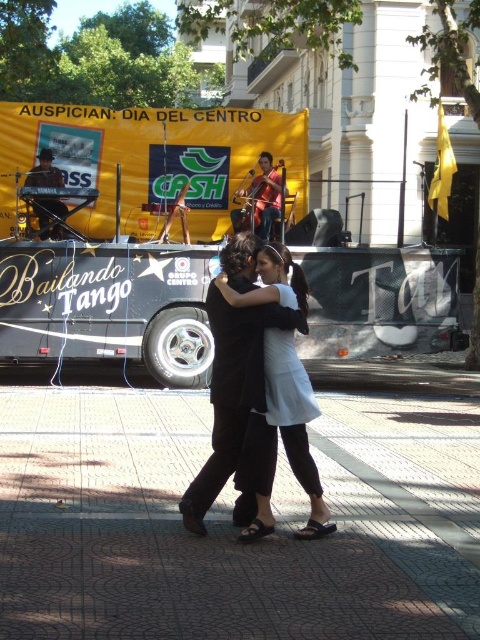
Question: Does black matte dress at center appear on the right side of shiny black drum set at upper left?

Choices:
 (A) no
 (B) yes

Answer: (B)

Question: Can you confirm if orange fabric cello at center is positioned to the left of shiny black drum set at upper left?

Choices:
 (A) no
 (B) yes

Answer: (A)

Question: Which object is positioned farthest from the shiny black drum set at upper left?

Choices:
 (A) black matte dress at center
 (B) orange fabric cello at center

Answer: (A)

Question: Can you confirm if orange fabric cello at center is positioned to the left of shiny black drum set at upper left?

Choices:
 (A) no
 (B) yes

Answer: (A)

Question: Which point is farther to the camera?

Choices:
 (A) click(x=201, y=502)
 (B) click(x=40, y=208)
 (C) click(x=280, y=196)

Answer: (C)

Question: Which of the following is the farthest from the observer?

Choices:
 (A) shiny black drum set at upper left
 (B) black matte dress at center

Answer: (A)